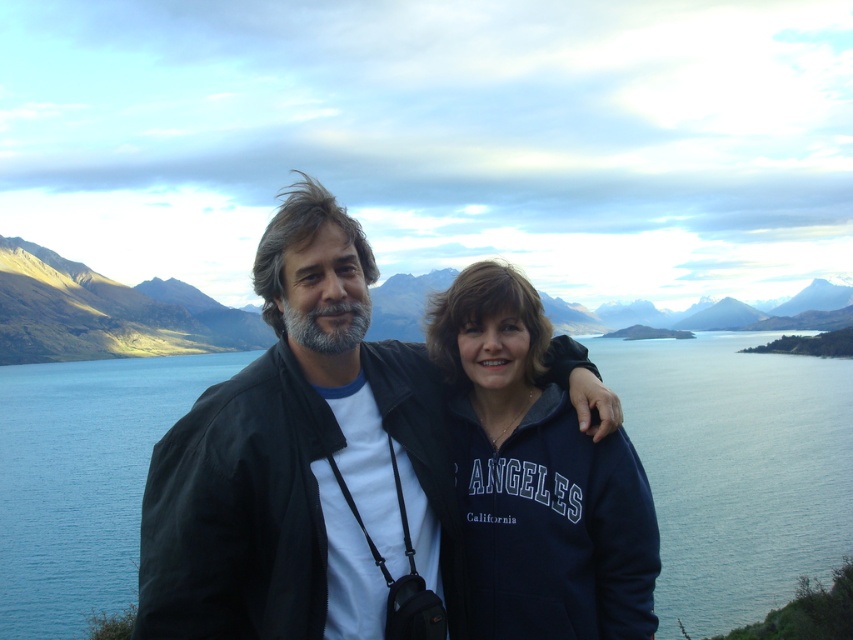
You are standing in the scenic outdoor setting described. You want to take a photo of the blue water at center without including the dark blue jacket at center in the frame. Which direction should you move to achieve this?

You should move to the left to avoid including the dark blue jacket at center in the frame, as the dark blue jacket at center is positioned to the right of the blue water at center.

You are a photographer trying to capture a landscape shot of the blue water at center. There is a dark blue jacket at center in the way. Can you tell me if the jacket is blocking most of the water or just a small part?

The dark blue jacket at center occupies less space than blue water at center, so it is only blocking a small part of the water.

You are a photographer trying to capture a landscape shot of the blue water at center and the navy blue fleece at center. Which object should you adjust your camera angle to focus on first if you want to frame them both in the same shot?

The blue water at center is positioned on the left side of navy blue fleece at center, so you should adjust your camera angle to focus on the blue water at center first to ensure both objects are included in the frame.